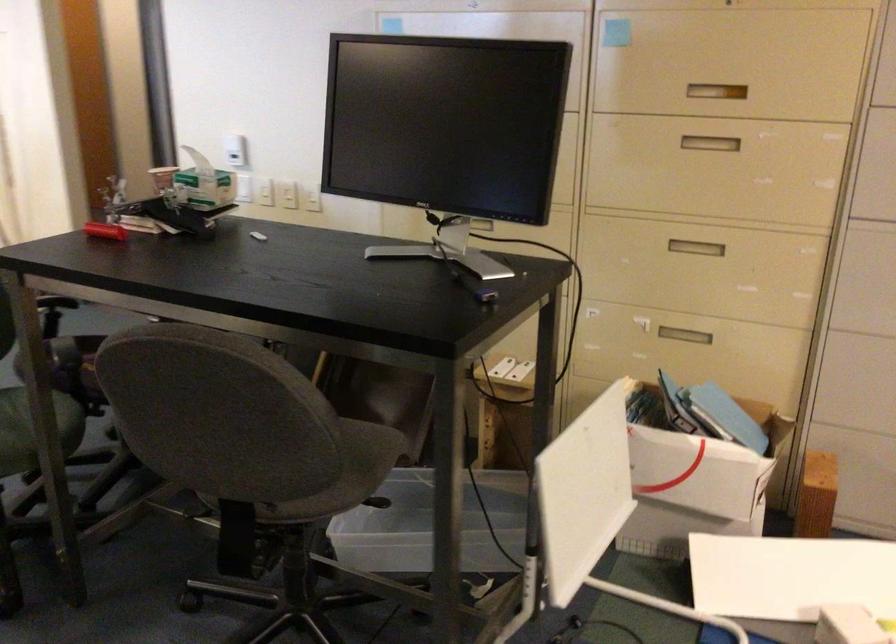
Where would you sit the gray chair sitting surface? Please return your answer as a coordinate pair (x, y).

(364, 462)